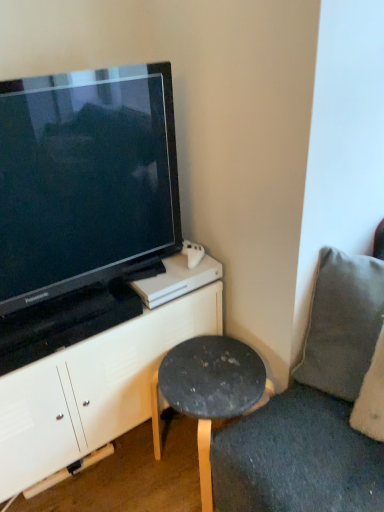
The width and height of the screenshot is (384, 512). I want to click on free point above dark gray stone stool at lower right (from a real-world perspective), so click(x=205, y=372).